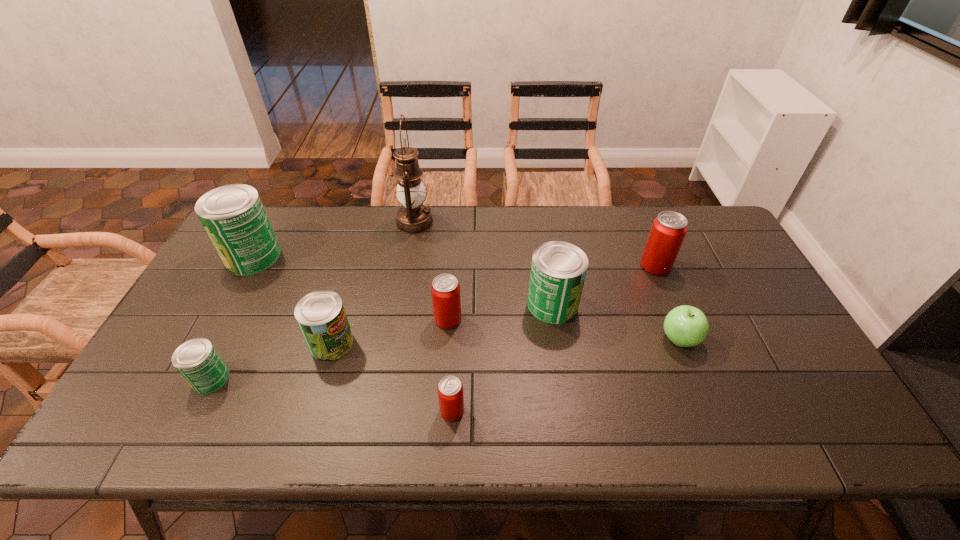
Identify the location of free area in between the second smallest red can and the second nearest green can. (390, 331).

Find the location of a particular element. The height and width of the screenshot is (540, 960). vacant area that lies between the farthest red can and the third object from right to left is located at coordinates (604, 285).

This screenshot has width=960, height=540. Identify the location of free spot between the apple and the rightmost green can. (616, 322).

You are a GUI agent. You are given a task and a screenshot of the screen. Output one action in this format:
    pyautogui.click(x=<x>, y=<y>)
    Task: Click on the closest object to the oil lamp
    This screenshot has height=540, width=960.
    Given the screenshot: What is the action you would take?
    pyautogui.click(x=445, y=290)

Where is `the eighth closest object relative to the second farthest green can`? This screenshot has width=960, height=540. the eighth closest object relative to the second farthest green can is located at coordinates (233, 216).

The width and height of the screenshot is (960, 540). Identify the location of can that stands as the seventh closest to the farthest object. (668, 231).

Identify which can is the second closest to the apple. Please provide its 2D coordinates. Your answer should be formatted as a tuple, i.e. [(x, y)], where the tuple contains the x and y coordinates of a point satisfying the conditions above.

[(558, 270)]

Identify which green can is the second nearest to the second smallest red can. Please provide its 2D coordinates. Your answer should be formatted as a tuple, i.e. [(x, y)], where the tuple contains the x and y coordinates of a point satisfying the conditions above.

[(321, 316)]

Point out which green can is positioned as the third nearest to the sixth can from left to right. Please provide its 2D coordinates. Your answer should be formatted as a tuple, i.e. [(x, y)], where the tuple contains the x and y coordinates of a point satisfying the conditions above.

[(233, 216)]

Identify which red can is the closest to the rightmost red can. Please provide its 2D coordinates. Your answer should be formatted as a tuple, i.e. [(x, y)], where the tuple contains the x and y coordinates of a point satisfying the conditions above.

[(445, 290)]